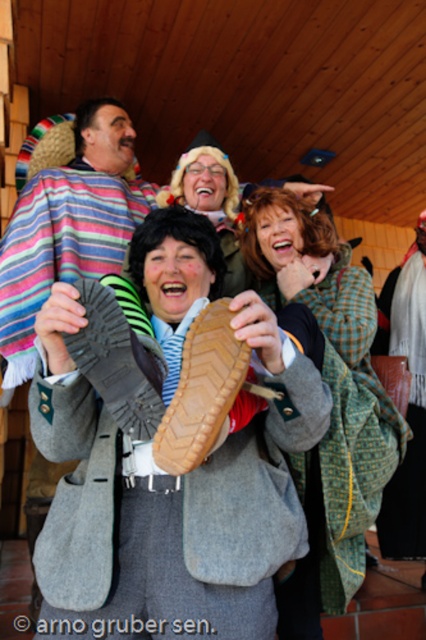
You are a photographer at the event and want to capture a photo of both the green plaid coat at center and the brown leather shoe at center. Based on their positions, which one should you focus on first to ensure both are in the frame?

The green plaid coat at center is located below the brown leather shoe at center, so you should focus on the brown leather shoe at center first to ensure both are in the frame.